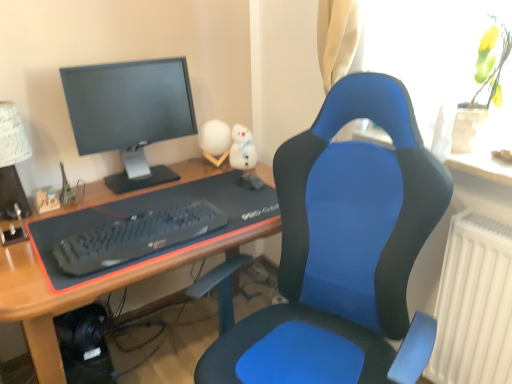
Locate an element on the screen. blank space above black matte keyboard at center (from a real-world perspective) is located at coordinates [129, 228].